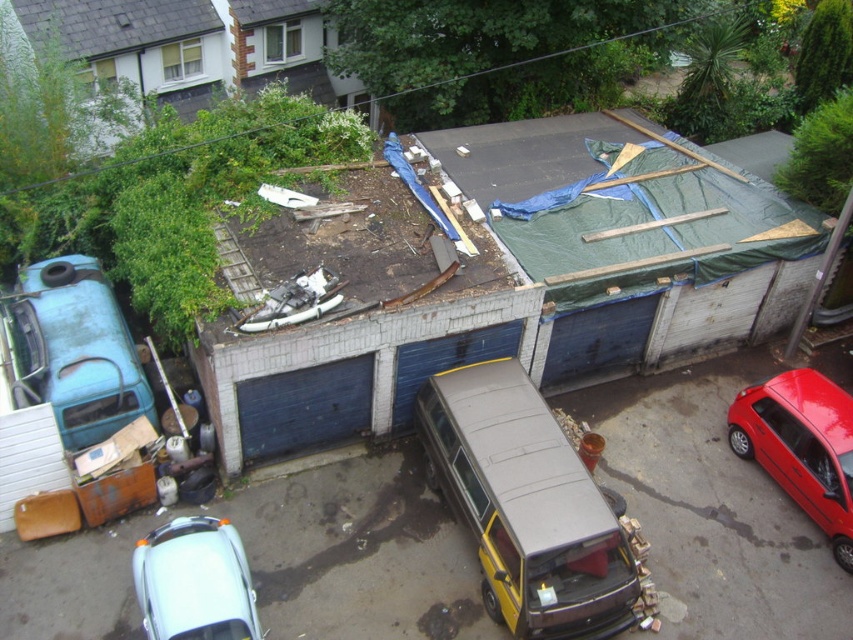
You are a delivery driver who needs to park your truck between the yellow matte van at center and the shiny red car at lower right. The truck requires a minimum of 4 meters of space. Is there enough space between them for your truck?

The yellow matte van at center is 5.20 meters away from the shiny red car at lower right. Since the truck needs at least 4 meters, there is sufficient space between them for the truck to park.

You are a delivery person needing to park your 2.5 meter wide truck between the yellow matte van at center and the white matte car at lower left. Is there enough space for your truck to fit between them?

The yellow matte van at center and the white matte car at lower left are 4.36 meters apart from each other. Since your truck is 2.5 meters wide, there is enough space for it to fit between them as 4.36 meters is greater than 2.5 meters.

Based on the photo, you are standing at the point marked by the coordinates point (526, 506) in the residential area. What object are you currently standing on?

The point (526, 506) corresponds to the yellow matte van at center, so you are standing on the yellow matte van at center.